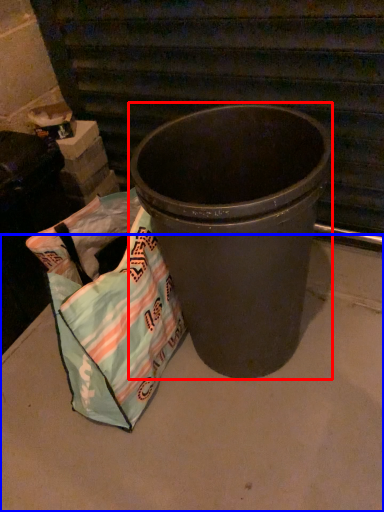
Question: Among these objects, which one is nearest to the camera, waste container (highlighted by a red box) or concrete (highlighted by a blue box)?

Choices:
 (A) waste container
 (B) concrete

Answer: (A)